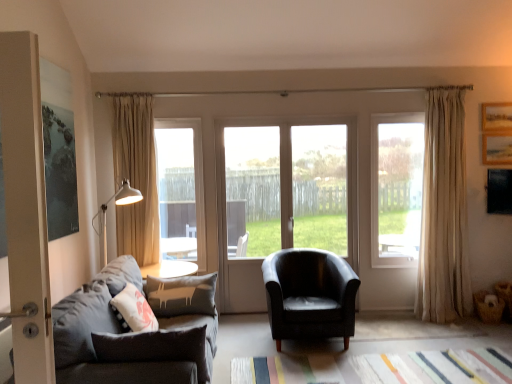
I want to click on free point above clear glass door at center, which is counted as the third window, starting from the right (from a real-world perspective), so click(175, 120).